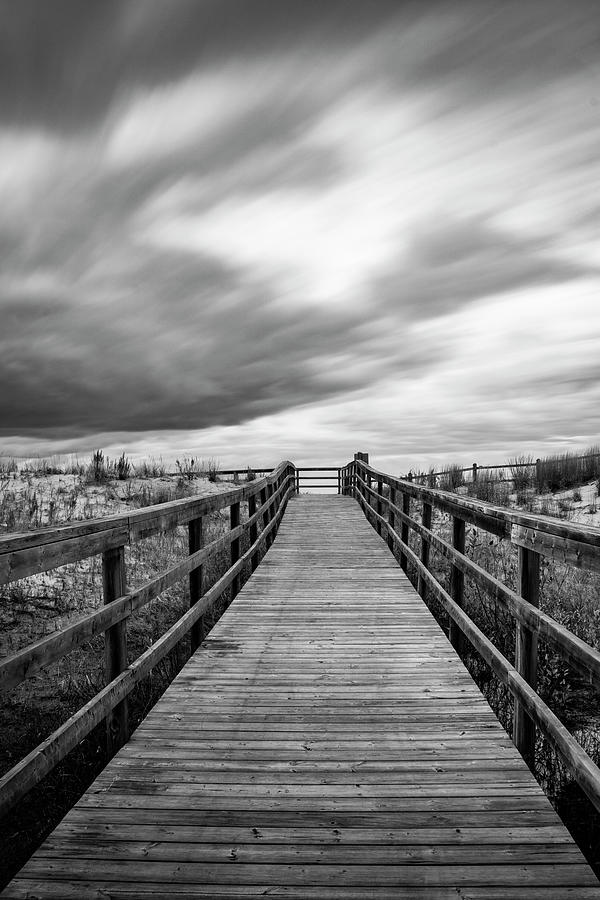
At what (x,y) coordinates should I click in order to perform the action: click on wooden slats. Please return your answer as a coordinate pair (x, y). This screenshot has height=900, width=600. Looking at the image, I should click on click(x=196, y=832), click(x=195, y=849), click(x=195, y=865).